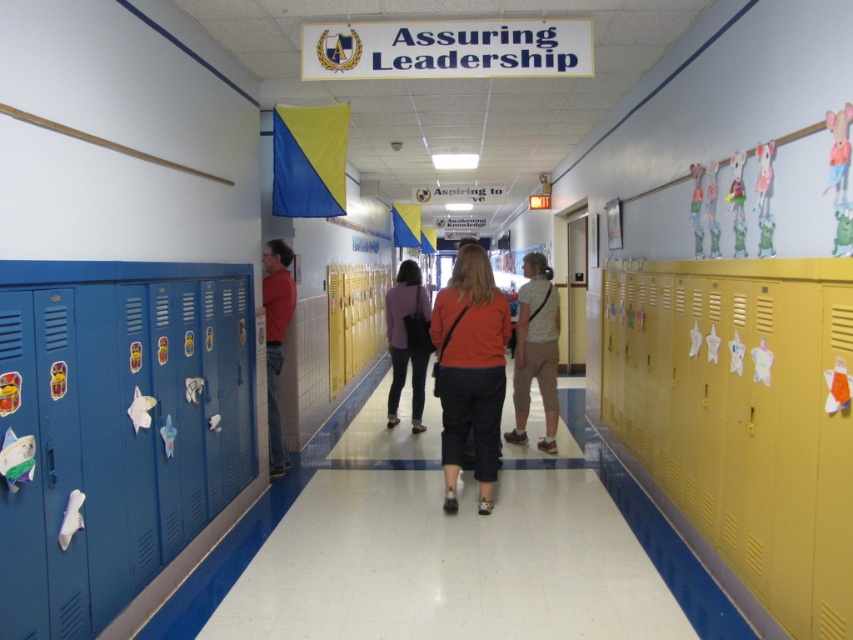
Does orange matte shirt at center lie behind matte purple sweater at center?

No.

Which is more to the left, orange matte shirt at center or matte purple sweater at center?

matte purple sweater at center

Identify the location of orange matte shirt at center. (469, 371).

Who is lower down, orange matte shirt at center or matte red shirt at left?

Positioned lower is orange matte shirt at center.

Can you confirm if orange matte shirt at center is positioned to the left of matte red shirt at left?

Incorrect, orange matte shirt at center is not on the left side of matte red shirt at left.

At what (x,y) coordinates should I click in order to perform the action: click on orange matte shirt at center. Please return your answer as a coordinate pair (x, y). Looking at the image, I should click on (469, 371).

You are a GUI agent. You are given a task and a screenshot of the screen. Output one action in this format:
    pyautogui.click(x=<x>, y=<y>)
    Task: Click on the orange matte shirt at center
    Image resolution: width=853 pixels, height=640 pixels.
    Given the screenshot: What is the action you would take?
    pyautogui.click(x=469, y=371)

Consider the image. Is orange matte shirt at center shorter than camouflage-patterned shirt at center?

In fact, orange matte shirt at center may be taller than camouflage-patterned shirt at center.

Between orange matte shirt at center and camouflage-patterned shirt at center, which one is positioned higher?

Positioned higher is camouflage-patterned shirt at center.

Between point (479, 330) and point (521, 337), which one is positioned behind?

Point (521, 337)

Where is `orange matte shirt at center`? The height and width of the screenshot is (640, 853). orange matte shirt at center is located at coordinates (469, 371).